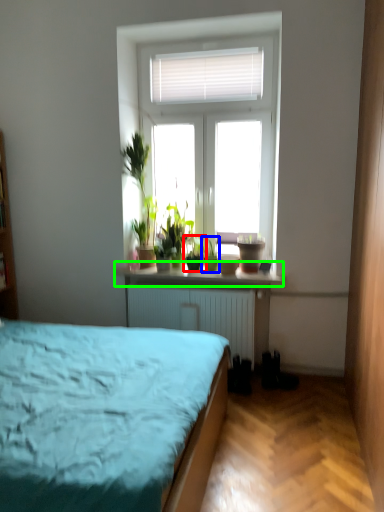
Question: Which object is positioned farthest from houseplant (highlighted by a red box)? Select from houseplant (highlighted by a blue box) and window sill (highlighted by a green box).

Choices:
 (A) houseplant
 (B) window sill

Answer: (B)